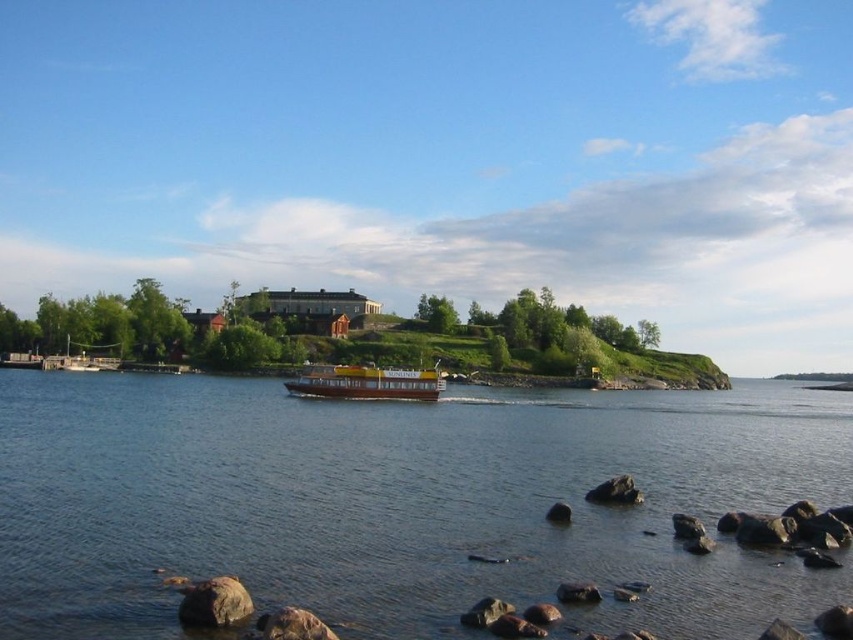
Question: Based on their relative distances, which object is farther from the wooden dock at lower left?

Choices:
 (A) blue water at center
 (B) yellow matte boat at center

Answer: (A)

Question: Can you confirm if blue water at center is smaller than wooden dock at lower left?

Choices:
 (A) no
 (B) yes

Answer: (A)

Question: Can you confirm if blue water at center is bigger than yellow matte boat at center?

Choices:
 (A) no
 (B) yes

Answer: (B)

Question: Which point is farther to the camera?

Choices:
 (A) (109, 353)
 (B) (358, 378)
 (C) (781, 428)

Answer: (A)

Question: Which of the following is the farthest from the observer?

Choices:
 (A) (109, 356)
 (B) (434, 378)
 (C) (453, 403)

Answer: (A)

Question: Considering the relative positions of yellow matte boat at center and wooden dock at lower left in the image provided, where is yellow matte boat at center located with respect to wooden dock at lower left?

Choices:
 (A) left
 (B) right

Answer: (B)